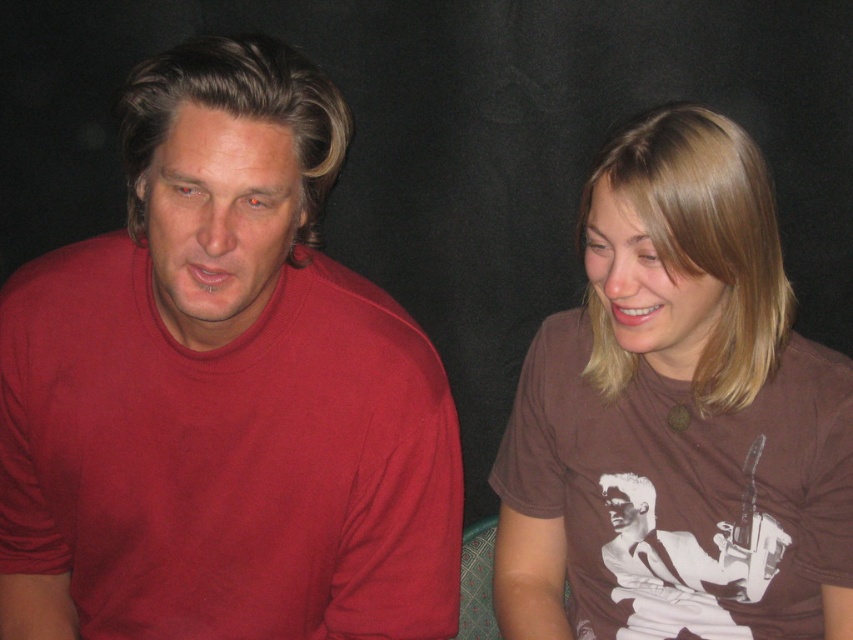
Describe the element at coordinates (222, 392) in the screenshot. I see `matte red t-shirt at left` at that location.

Which of these two, matte red t-shirt at left or brown cotton t-shirt at right, stands shorter?

matte red t-shirt at left is shorter.

At what (x,y) coordinates should I click in order to perform the action: click on matte red t-shirt at left. Please return your answer as a coordinate pair (x, y). The height and width of the screenshot is (640, 853). Looking at the image, I should click on (222, 392).